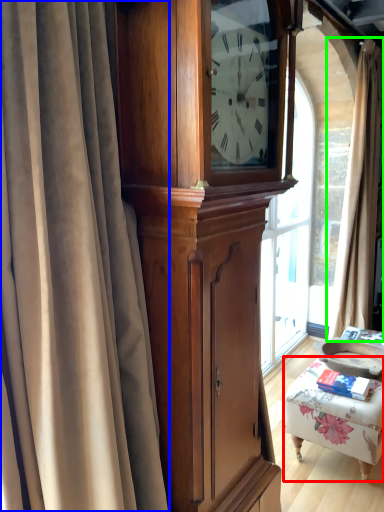
Question: Which is farther away from furniture (highlighted by a red box)? curtain (highlighted by a blue box) or curtain (highlighted by a green box)?

Choices:
 (A) curtain
 (B) curtain

Answer: (A)